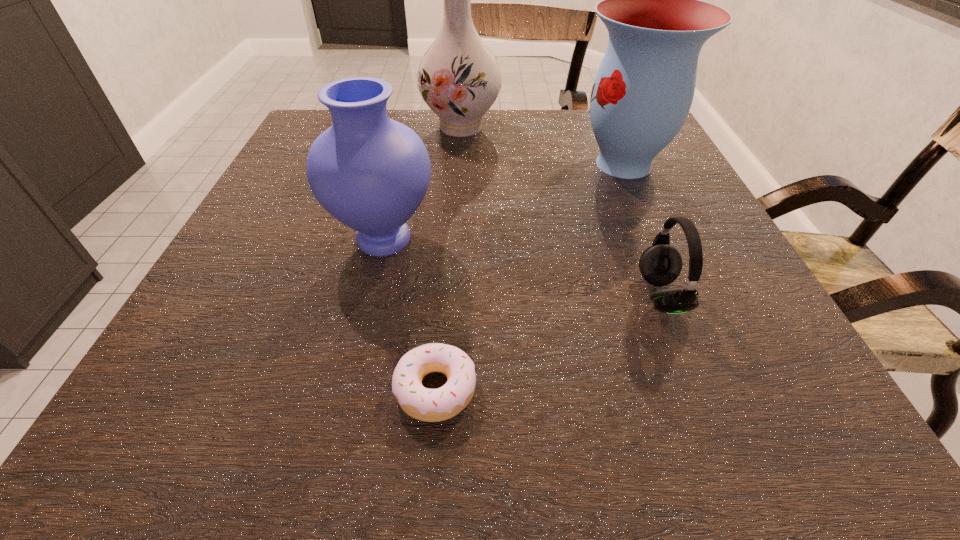
You are a GUI agent. You are given a task and a screenshot of the screen. Output one action in this format:
    pyautogui.click(x=<x>, y=<y>)
    Task: Click on the vacant point that satisfies the following two spatial constraints: 1. on the ear cups of the headset; 2. on the front side of the nearest object
    
    Given the screenshot: What is the action you would take?
    pyautogui.click(x=698, y=389)